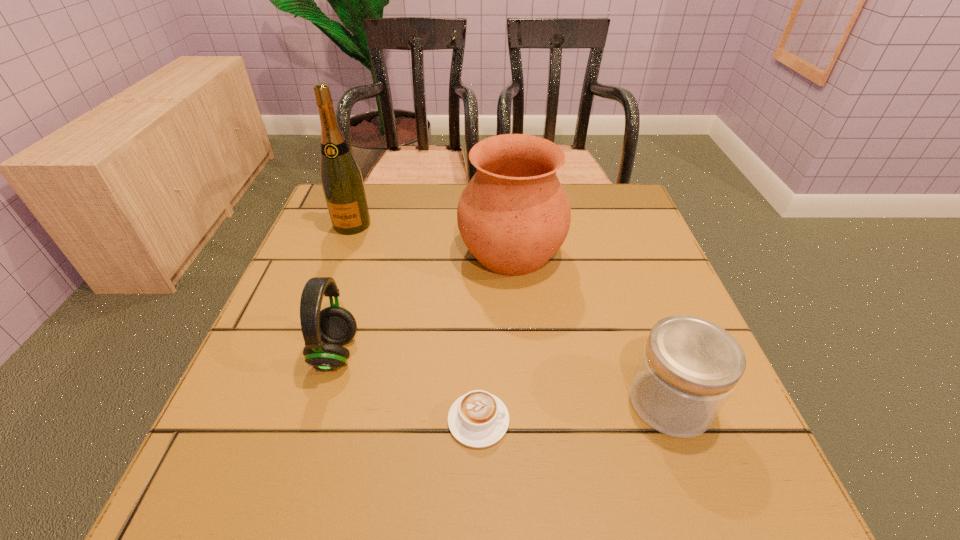
Image resolution: width=960 pixels, height=540 pixels. I want to click on vacant space at the far left corner, so click(x=372, y=208).

At what (x,y) coordinates should I click in order to perform the action: click on free space at the far right corner of the desktop. Please return your answer as a coordinate pair (x, y). This screenshot has height=540, width=960. Looking at the image, I should click on (623, 197).

I want to click on vacant space at the near right corner of the desktop, so click(686, 451).

This screenshot has width=960, height=540. In order to click on empty space that is in between the jar and the headset in this screenshot , I will do `click(503, 377)`.

You are a GUI agent. You are given a task and a screenshot of the screen. Output one action in this format:
    pyautogui.click(x=<x>, y=<y>)
    Task: Click on the vacant region between the headset and the jar
    Image resolution: width=960 pixels, height=540 pixels.
    Given the screenshot: What is the action you would take?
    pyautogui.click(x=503, y=377)

Find the location of a particular element. free spot between the headset and the cappuccino is located at coordinates (407, 387).

Image resolution: width=960 pixels, height=540 pixels. What are the coordinates of `free area in between the fourth shortest object and the cappuccino` in the screenshot? It's located at (495, 336).

At what (x,y) coordinates should I click in order to perform the action: click on empty location between the headset and the cappuccino. Please return your answer as a coordinate pair (x, y). Image resolution: width=960 pixels, height=540 pixels. Looking at the image, I should click on (407, 387).

Identify the location of vacant region between the shortest object and the tallest object. (416, 322).

Where is `free space that is in between the headset and the tallest object`? free space that is in between the headset and the tallest object is located at coordinates (344, 289).